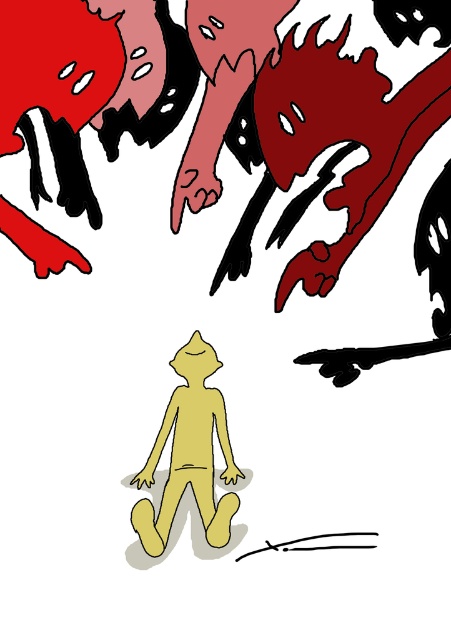
Question: Is smooth red zombie at upper right smaller than yellow matte figure at center?

Choices:
 (A) no
 (B) yes

Answer: (A)

Question: Which point appears closest to the camera in this image?

Choices:
 (A) 354,225
 (B) 210,388

Answer: (B)

Question: Considering the relative positions of smooth red zombie at upper right and yellow matte figure at center in the image provided, where is smooth red zombie at upper right located with respect to yellow matte figure at center?

Choices:
 (A) right
 (B) left

Answer: (A)

Question: Which point appears closest to the camera in this image?

Choices:
 (A) (201, 340)
 (B) (381, 179)

Answer: (A)

Question: Which point is farther from the camera taking this photo?

Choices:
 (A) (258, 88)
 (B) (143, 499)

Answer: (A)

Question: Can you confirm if smooth red zombie at upper right is positioned to the left of yellow matte figure at center?

Choices:
 (A) no
 (B) yes

Answer: (A)